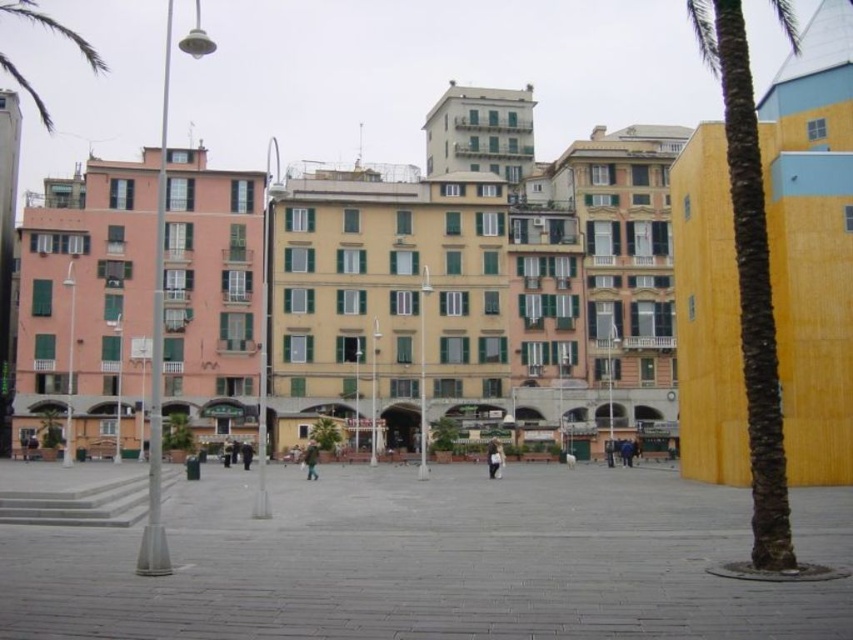
Is yellow matte palm tree at right in front of light brown leather jacket at center?

Yes, it is in front of light brown leather jacket at center.

Is yellow matte palm tree at right smaller than light brown leather jacket at center?

No, yellow matte palm tree at right is not smaller than light brown leather jacket at center.

Image resolution: width=853 pixels, height=640 pixels. What are the coordinates of `yellow matte palm tree at right` in the screenshot? It's located at (750, 282).

You are a GUI agent. You are given a task and a screenshot of the screen. Output one action in this format:
    pyautogui.click(x=<x>, y=<y>)
    Task: Click on the yellow matte palm tree at right
    The width and height of the screenshot is (853, 640).
    Given the screenshot: What is the action you would take?
    750,282

Is light brown leather jacket at center to the right of green fabric person at center from the viewer's perspective?

Correct, you'll find light brown leather jacket at center to the right of green fabric person at center.

Which is more to the right, light brown leather jacket at center or green fabric person at center?

light brown leather jacket at center

Which is in front, point (502, 464) or point (315, 474)?

Positioned in front is point (315, 474).

You are a GUI agent. You are given a task and a screenshot of the screen. Output one action in this format:
    pyautogui.click(x=<x>, y=<y>)
    Task: Click on the light brown leather jacket at center
    The width and height of the screenshot is (853, 640).
    Given the screenshot: What is the action you would take?
    pyautogui.click(x=494, y=458)

Who is positioned more to the left, yellow matte palm tree at right or green fabric person at center?

green fabric person at center is more to the left.

Between point (751, 115) and point (316, 460), which one is positioned in front?

Point (751, 115) is in front.

What do you see at coordinates (750, 282) in the screenshot? Image resolution: width=853 pixels, height=640 pixels. I see `yellow matte palm tree at right` at bounding box center [750, 282].

The height and width of the screenshot is (640, 853). Identify the location of yellow matte palm tree at right. (750, 282).